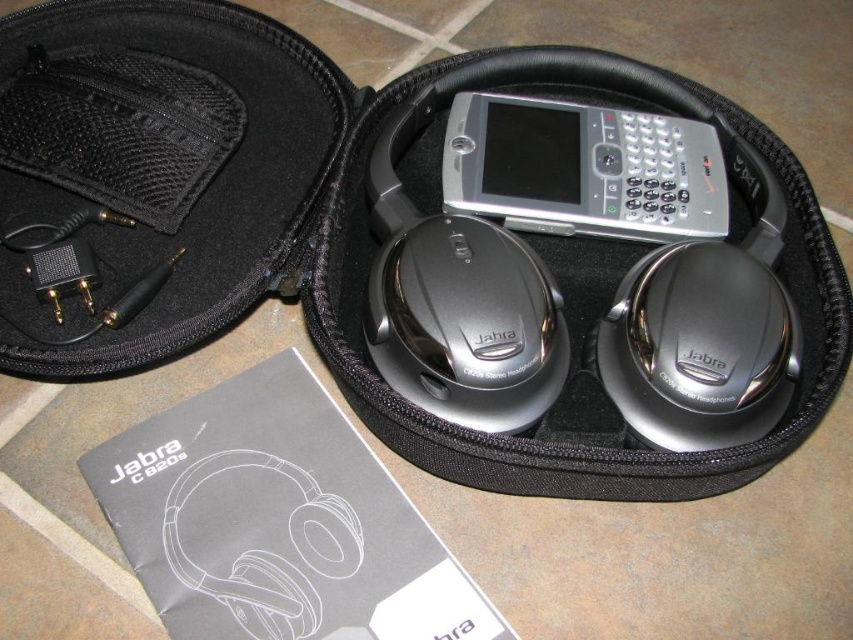
Question: Does silver metallic smartphone at center have a greater width compared to satin silver headphones at center?

Choices:
 (A) no
 (B) yes

Answer: (B)

Question: Which object appears farthest from the camera in this image?

Choices:
 (A) silver metallic smartphone at center
 (B) satin silver headphones at center

Answer: (A)

Question: Where is silver metallic smartphone at center located in relation to satin silver headphones at center in the image?

Choices:
 (A) right
 (B) left

Answer: (A)

Question: Where is silver metallic smartphone at center located in relation to satin silver headphones at center in the image?

Choices:
 (A) above
 (B) below

Answer: (A)